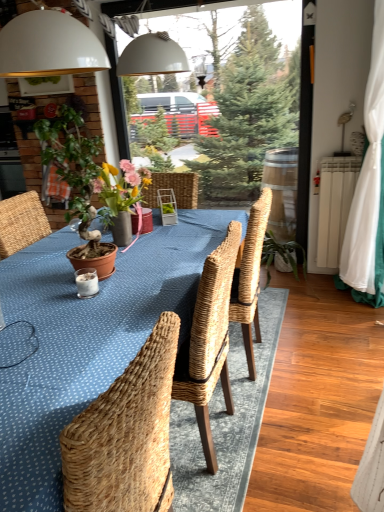
Find the location of a particular element. The height and width of the screenshot is (512, 384). free space above blue woven table at center (from a real-world perspective) is located at coordinates (68, 313).